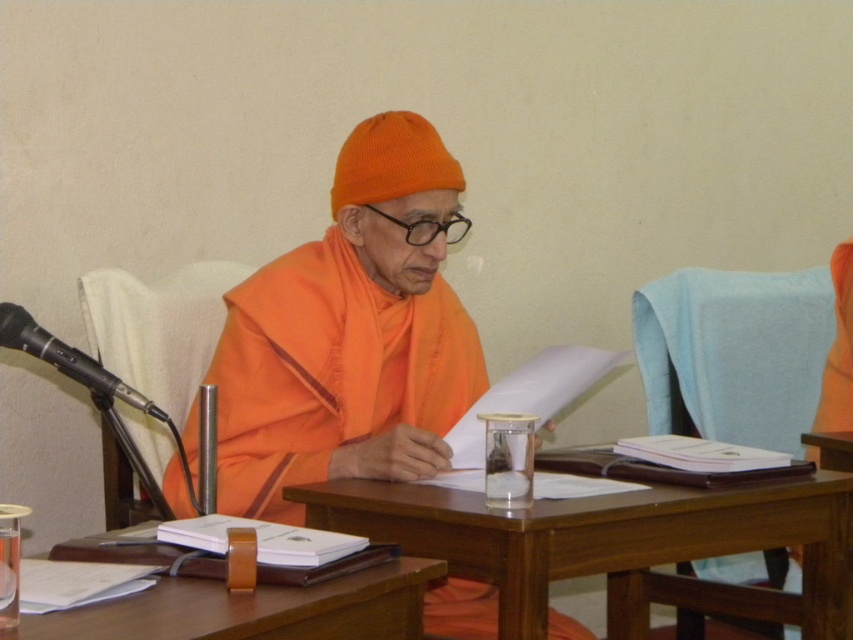
You are standing in front of the table in the image and want to place an item on the table. You have two points to choose from, point A at coordinates point (149,378) and point B at coordinates point (54,348). Which point is closer to you?

Point A at coordinates point (149,378) is closer to you because it is further to the viewer than point B at coordinates point (54,348).

You are a photographer in a meeting room and want to take a photo of the orange clothed figure at center. The camera you are using has a focus point at coordinate point (351, 333). Will this focus point be on the orange clothed figure at center?

Yes, the focus point at point (351, 333) is on the orange clothed figure at center, so the camera will focus on the figure.